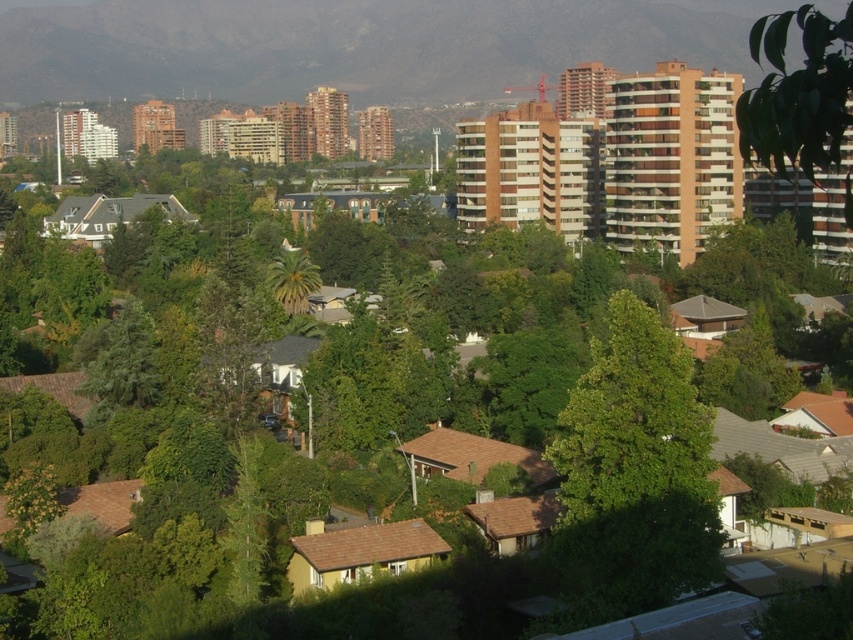
Question: Does green leafy hillside at upper center appear on the right side of green leafy tree at upper right?

Choices:
 (A) no
 (B) yes

Answer: (A)

Question: Which point appears closest to the camera in this image?

Choices:
 (A) (676, 426)
 (B) (396, 33)
 (C) (808, 140)

Answer: (C)

Question: Which point is farther from the camera taking this photo?

Choices:
 (A) (548, 44)
 (B) (572, 582)

Answer: (A)

Question: Which of these objects is positioned closest to the green leafy tree at upper right?

Choices:
 (A) green leafy hillside at upper center
 (B) green leafy tree at center

Answer: (B)

Question: Is green leafy hillside at upper center positioned before green leafy tree at upper right?

Choices:
 (A) yes
 (B) no

Answer: (B)

Question: Is green leafy hillside at upper center thinner than green leafy tree at upper right?

Choices:
 (A) yes
 (B) no

Answer: (B)